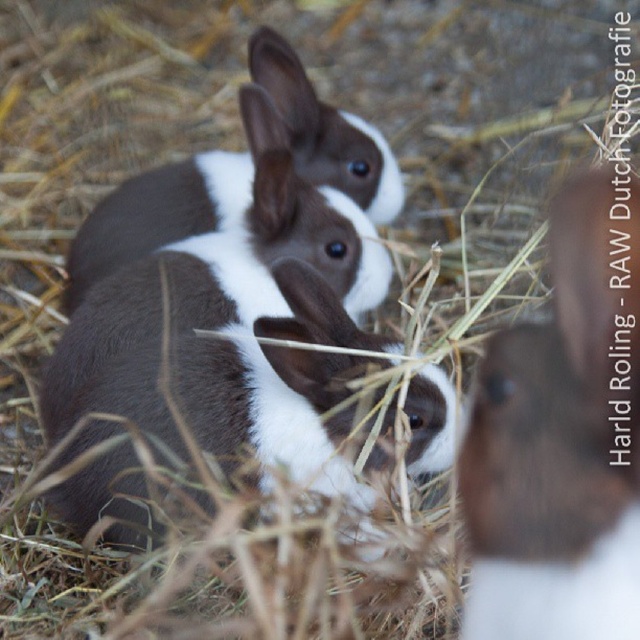
Between brown fur rabbit at center and brown and white fur rabbit at center, which one has less height?

With less height is brown fur rabbit at center.

Can you confirm if brown fur rabbit at center is positioned to the left of brown and white fur rabbit at center?

Incorrect, brown fur rabbit at center is not on the left side of brown and white fur rabbit at center.

Is point (637, 582) farther from viewer compared to point (285, 120)?

That is False.

Image resolution: width=640 pixels, height=640 pixels. In order to click on brown fur rabbit at center in this screenshot , I will do `click(561, 436)`.